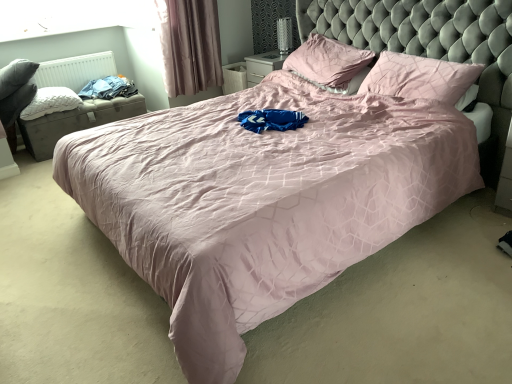
Question: Could you tell me if blue cotton clothes at left is turned towards mauve velvet curtain at upper left?

Choices:
 (A) yes
 (B) no

Answer: (B)

Question: From a real-world perspective, is blue cotton clothes at left positioned over mauve velvet curtain at upper left based on gravity?

Choices:
 (A) no
 (B) yes

Answer: (A)

Question: From the image's perspective, does blue cotton clothes at left appear lower than mauve velvet curtain at upper left?

Choices:
 (A) no
 (B) yes

Answer: (B)

Question: Considering the relative sizes of blue cotton clothes at left and mauve velvet curtain at upper left in the image provided, is blue cotton clothes at left bigger than mauve velvet curtain at upper left?

Choices:
 (A) yes
 (B) no

Answer: (B)

Question: Does blue cotton clothes at left have a lesser width compared to mauve velvet curtain at upper left?

Choices:
 (A) no
 (B) yes

Answer: (A)

Question: Is blue cotton clothes at left surrounding mauve velvet curtain at upper left?

Choices:
 (A) yes
 (B) no

Answer: (B)

Question: From a real-world perspective, is blue cotton clothes at left physically below white quilted pillow at left, marked as the 3th pillow in a right-to-left arrangement?

Choices:
 (A) yes
 (B) no

Answer: (B)

Question: Does blue cotton clothes at left appear on the right side of white quilted pillow at left, marked as the 3th pillow in a right-to-left arrangement?

Choices:
 (A) no
 (B) yes

Answer: (B)

Question: Does blue cotton clothes at left have a lesser width compared to white quilted pillow at left, marked as the 3th pillow in a right-to-left arrangement?

Choices:
 (A) no
 (B) yes

Answer: (B)

Question: Could you tell me if blue cotton clothes at left is turned towards white quilted pillow at left, arranged as the 1th pillow when viewed from the left?

Choices:
 (A) yes
 (B) no

Answer: (B)

Question: Would you consider blue cotton clothes at left to be distant from white quilted pillow at left, marked as the 3th pillow in a right-to-left arrangement?

Choices:
 (A) yes
 (B) no

Answer: (B)

Question: Is white quilted pillow at left, marked as the 3th pillow in a right-to-left arrangement, surrounded by blue cotton clothes at left?

Choices:
 (A) yes
 (B) no

Answer: (B)

Question: From the image's perspective, is pink satin pillow at upper center, which is the 2th pillow in left-to-right order, above metallic silver table lamp at upper center?

Choices:
 (A) no
 (B) yes

Answer: (A)